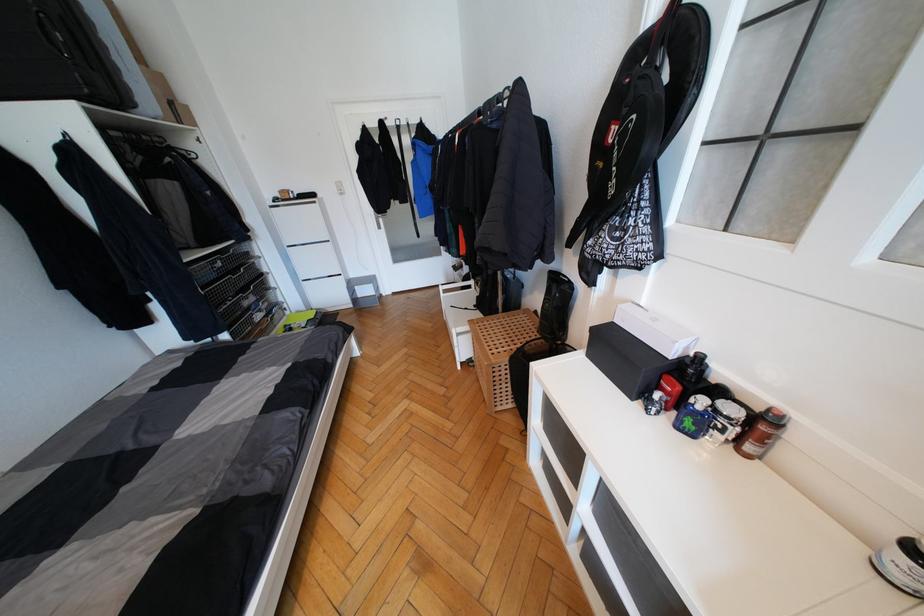
What do you see at coordinates (503, 331) in the screenshot?
I see `the wooden hamper lid` at bounding box center [503, 331].